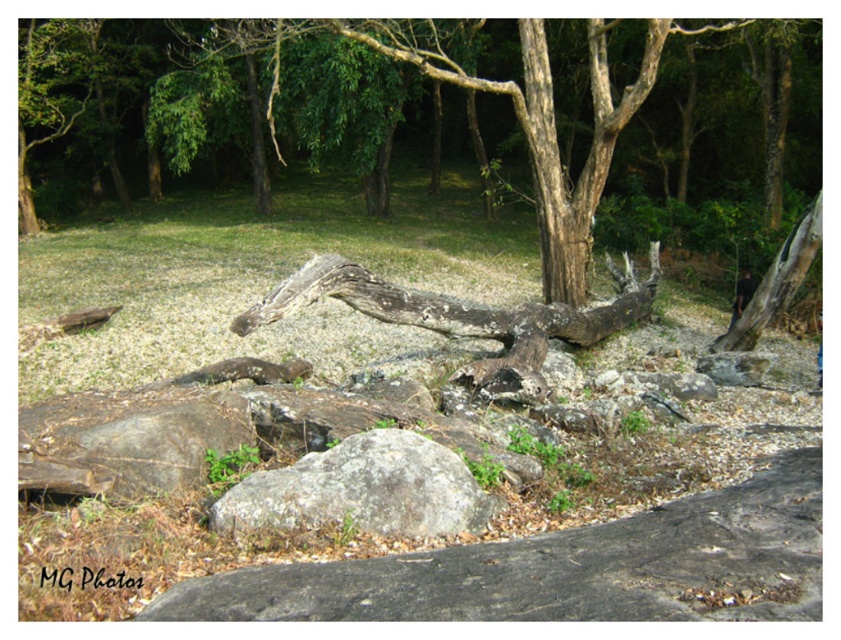
Question: Is gray rough rock at center below weathered wood log at center?

Choices:
 (A) yes
 (B) no

Answer: (A)

Question: Is gray rough rock at center to the right of weathered wood log at center from the viewer's perspective?

Choices:
 (A) no
 (B) yes

Answer: (A)

Question: Which object appears closest to the camera in this image?

Choices:
 (A) weathered wood log at center
 (B) gray rough rock at center

Answer: (B)

Question: Which of the following is the closest to the observer?

Choices:
 (A) weathered wood log at center
 (B) gray rough rock at center

Answer: (B)

Question: Is gray rough rock at center to the right of weathered wood log at center from the viewer's perspective?

Choices:
 (A) no
 (B) yes

Answer: (A)